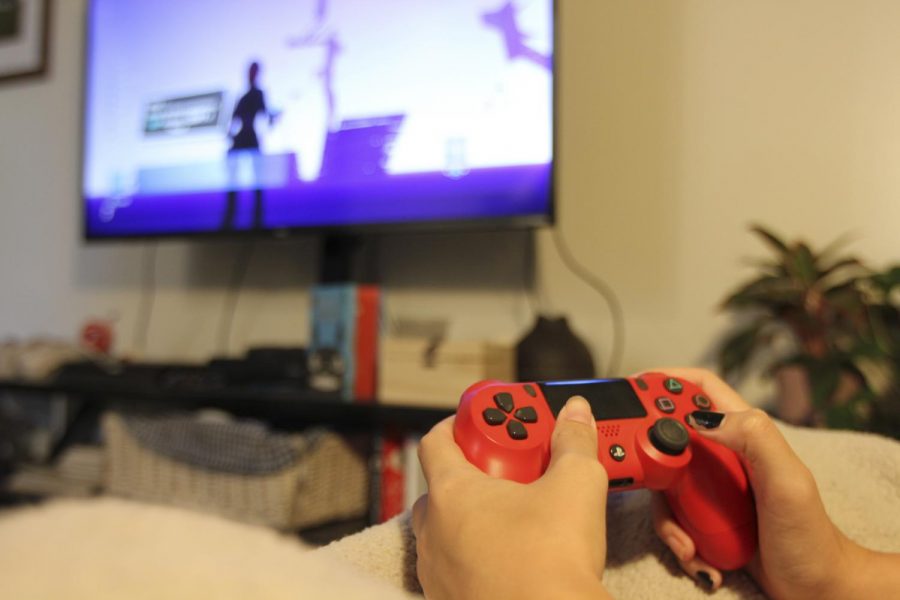
Find the location of `pot`. pot is located at coordinates (792, 389).